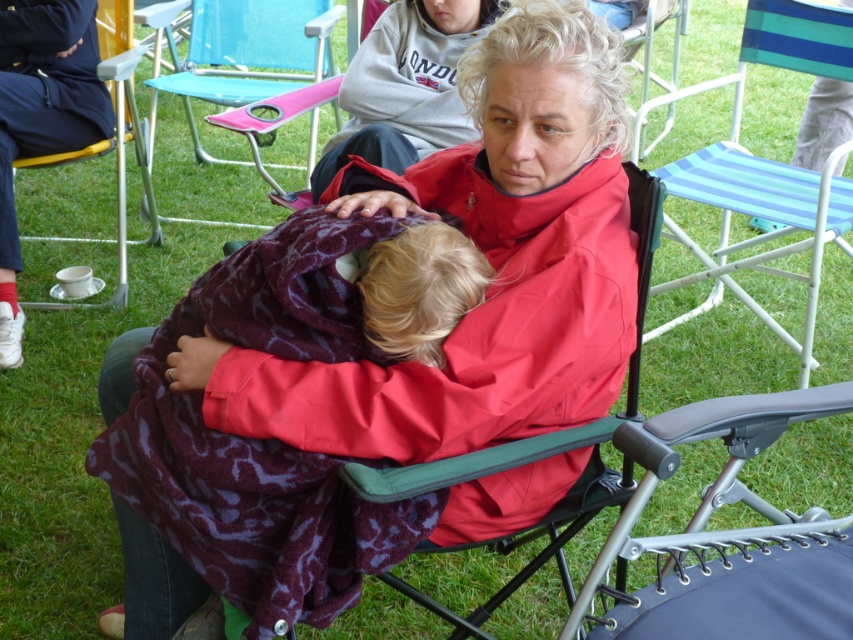
You are a photographer trying to capture a candid shot of the woman and child without disturbing them. You notice the maroon fleece blanket at center and the red fabric chair at center. Which object is closer to the camera, based on their positions?

The maroon fleece blanket at center is positioned under the red fabric chair at center, so the red fabric chair at center is closer to the camera.

Consider the image. You are a photographer trying to capture a closeup of the woman and child. You notice two points in the scene at coordinates point (579,29) and point (633,164). Which point should you focus on to ensure the subject is in focus?

You should focus on point (579,29) because it is closer to the camera than point (633,164), ensuring the subject is in focus.